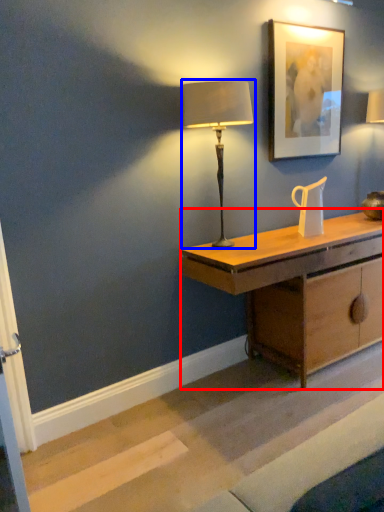
Question: Which point is further to the camera, desk (highlighted by a red box) or lamp (highlighted by a blue box)?

Choices:
 (A) desk
 (B) lamp

Answer: (A)